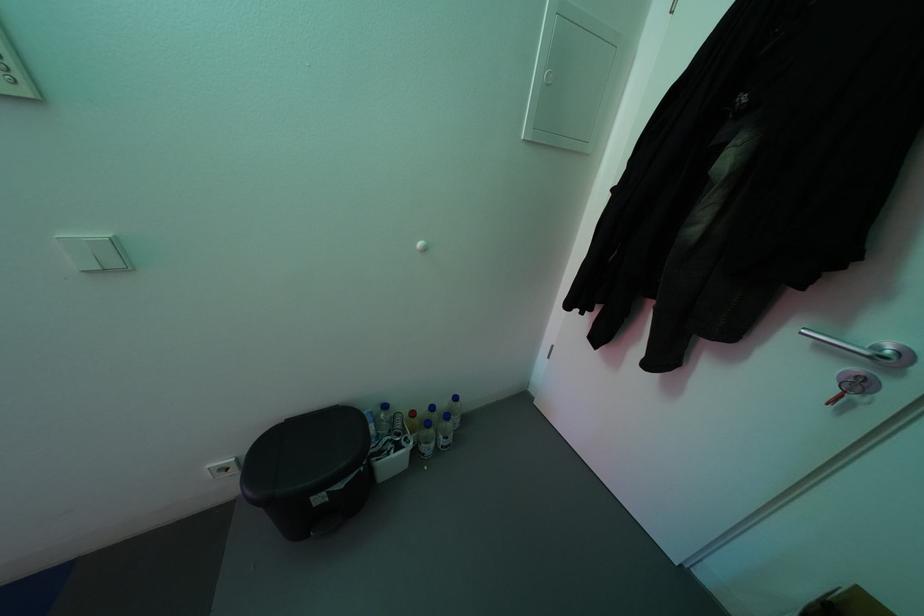
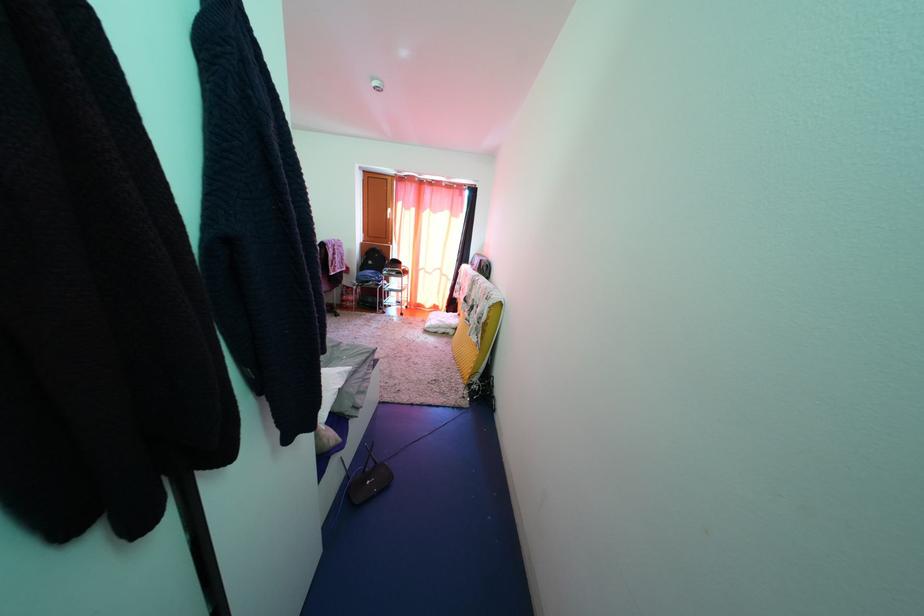
How did the camera likely rotate?

The camera rotated toward left-down.